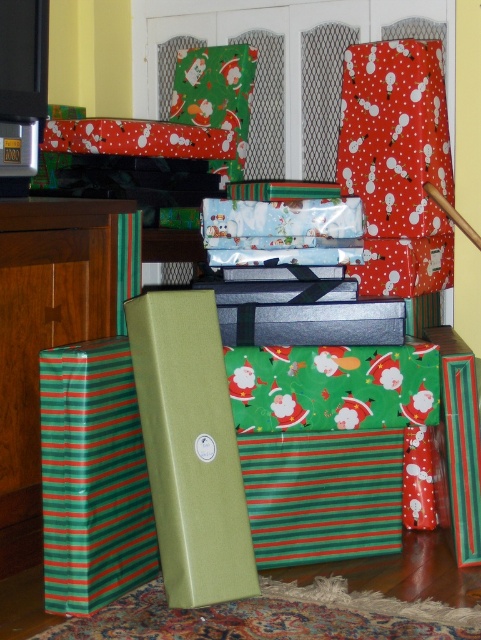
Between point (134, 412) and point (25, 273), which one is positioned in front?

Point (134, 412) is in front.

Does green striped paper at lower left have a lesser width compared to green striped box at left?

Correct, green striped paper at lower left's width is less than green striped box at left's.

Does point (142, 477) come in front of point (110, 227)?

That is True.

You are a GUI agent. You are given a task and a screenshot of the screen. Output one action in this format:
    pyautogui.click(x=<x>, y=<y>)
    Task: Click on the green striped paper at lower left
    
    Given the screenshot: What is the action you would take?
    92,477